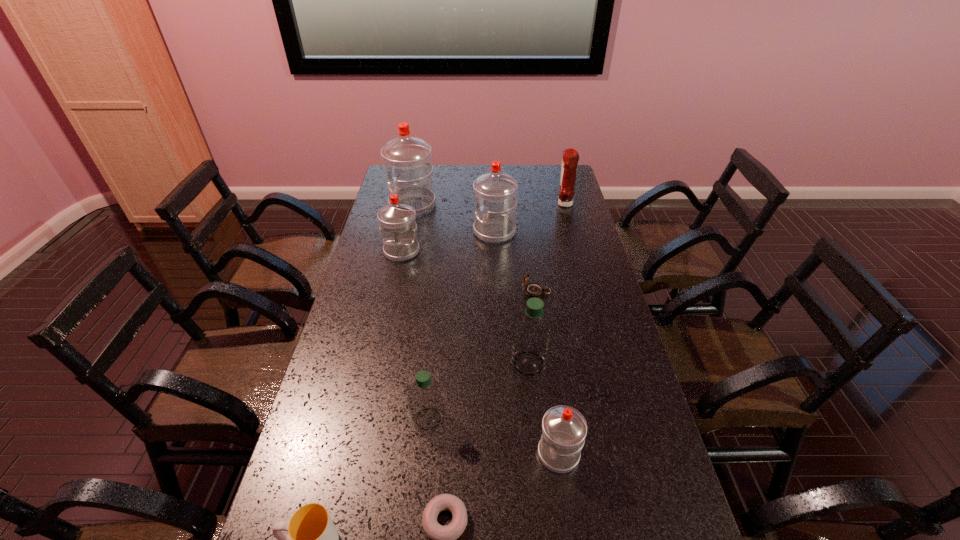
Find the location of a particular element. This screenshot has width=960, height=540. vacant region between the red condiment and the second tallest water bottle is located at coordinates (529, 218).

Where is `free space between the third biggest white water bottle and the nearest white water bottle`? free space between the third biggest white water bottle and the nearest white water bottle is located at coordinates (480, 353).

Identify the location of unoccupied area between the red condiment and the nearest white water bottle. Image resolution: width=960 pixels, height=540 pixels. (562, 329).

I want to click on vacant area that lies between the second biggest white water bottle and the right green water bottle, so click(x=512, y=298).

Where is `unoccupied area between the second tallest object and the farther green water bottle`? This screenshot has height=540, width=960. unoccupied area between the second tallest object and the farther green water bottle is located at coordinates (512, 298).

The width and height of the screenshot is (960, 540). What are the coordinates of `free point between the fifth farthest object and the farthest water bottle` in the screenshot? It's located at (474, 248).

Image resolution: width=960 pixels, height=540 pixels. I want to click on vacant point located between the third biggest white water bottle and the fourth water bottle from right to left, so click(x=415, y=335).

Image resolution: width=960 pixels, height=540 pixels. Find the location of `object that stands as the closest to the condiment`. object that stands as the closest to the condiment is located at coordinates (495, 193).

Locate which object ranks ninth in proximity to the doughnut. Please provide its 2D coordinates. Your answer should be formatted as a tuple, i.e. [(x, y)], where the tuple contains the x and y coordinates of a point satisfying the conditions above.

[(570, 159)]

Choose which water bottle is the second nearest neighbor to the second tallest object. Please provide its 2D coordinates. Your answer should be formatted as a tuple, i.e. [(x, y)], where the tuple contains the x and y coordinates of a point satisfying the conditions above.

[(397, 220)]